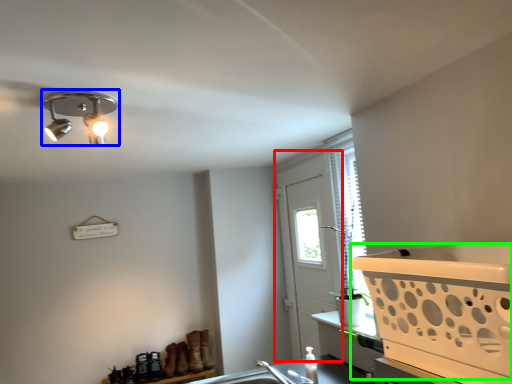
Question: Which is farther away from screen door (highlighted by a red box)? lamp (highlighted by a blue box) or basket (highlighted by a green box)?

Choices:
 (A) lamp
 (B) basket

Answer: (A)